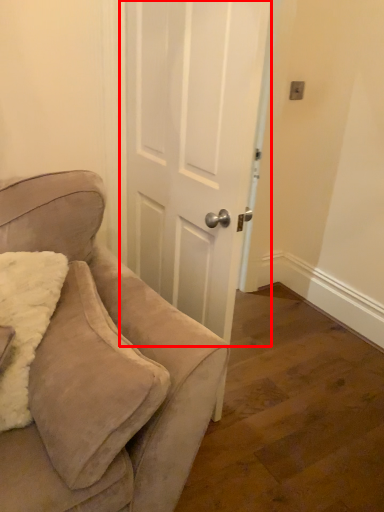
Question: In this image, where is door (annotated by the red box) located relative to chair?

Choices:
 (A) left
 (B) right

Answer: (B)